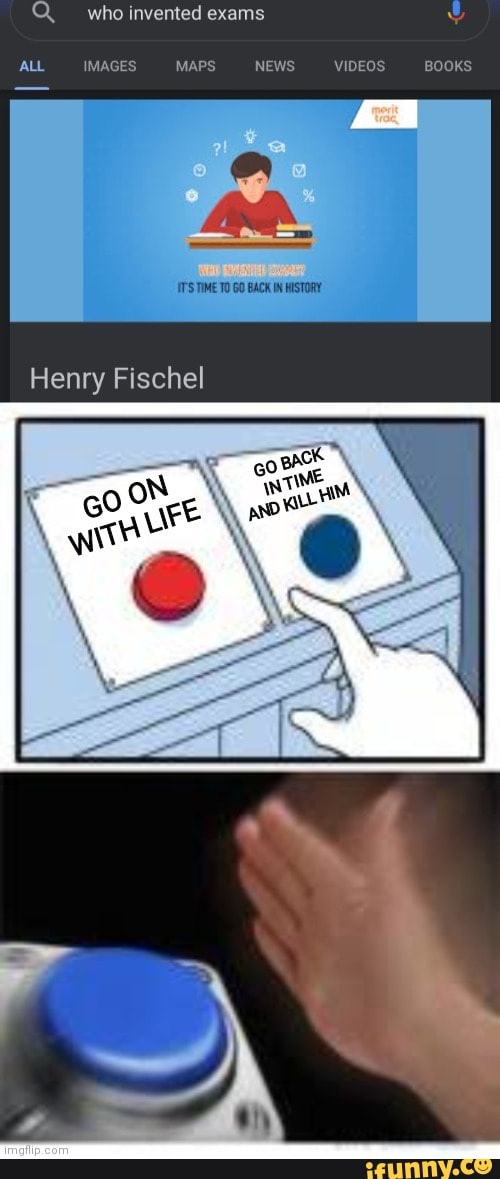
The width and height of the screenshot is (500, 1179). I want to click on pen, so click(x=247, y=220).